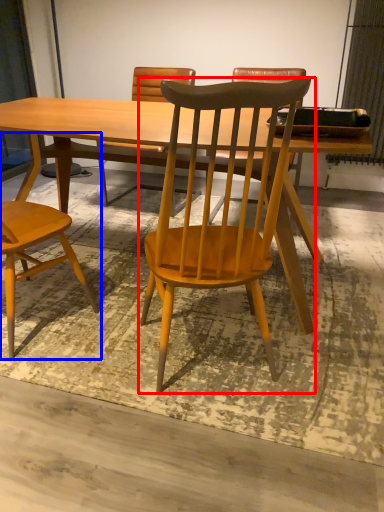
Question: Which of the following is the farthest to the observer, chair (highlighted by a red box) or chair (highlighted by a blue box)?

Choices:
 (A) chair
 (B) chair

Answer: (B)